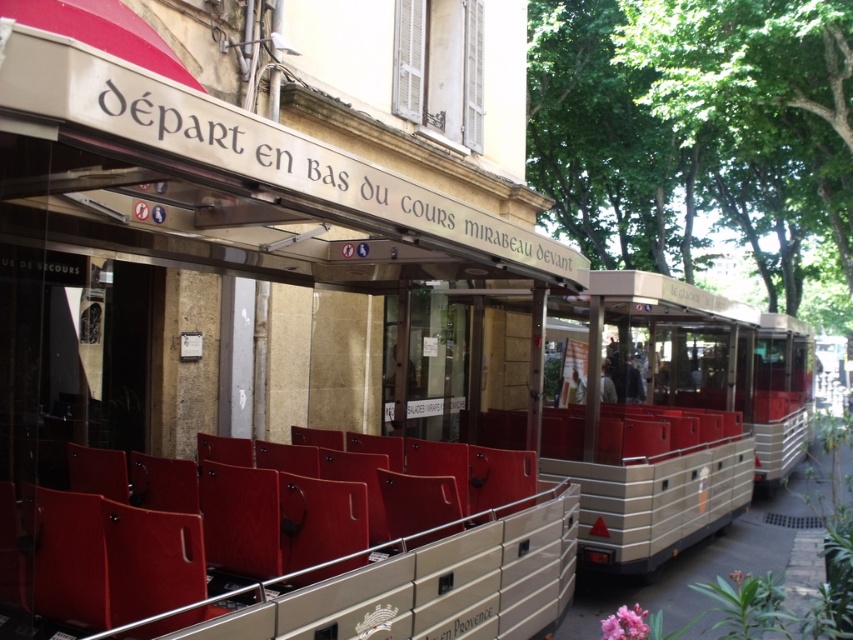
Consider the image. You are a tourist standing at the entrance of the building with the glass window. You want to sit down to rest before boarding the coach. Which object, the matte red chair at center or the metallic silver coach at center, is more suitable for a quick rest without blocking the entrance?

The matte red chair at center is thinner than the metallic silver coach at center, so the matte red chair at center is more suitable for a quick rest as it takes up less space near the entrance.

You are a tourist standing in front of the building with the glass window. You want to sit on the closest available seat. Which one should you choose between the matte red chair at center and the metallic silver coach at center?

The matte red chair at center occupies less space than the metallic silver coach at center, so it is closer to you and more accessible. Choose the matte red chair at center.